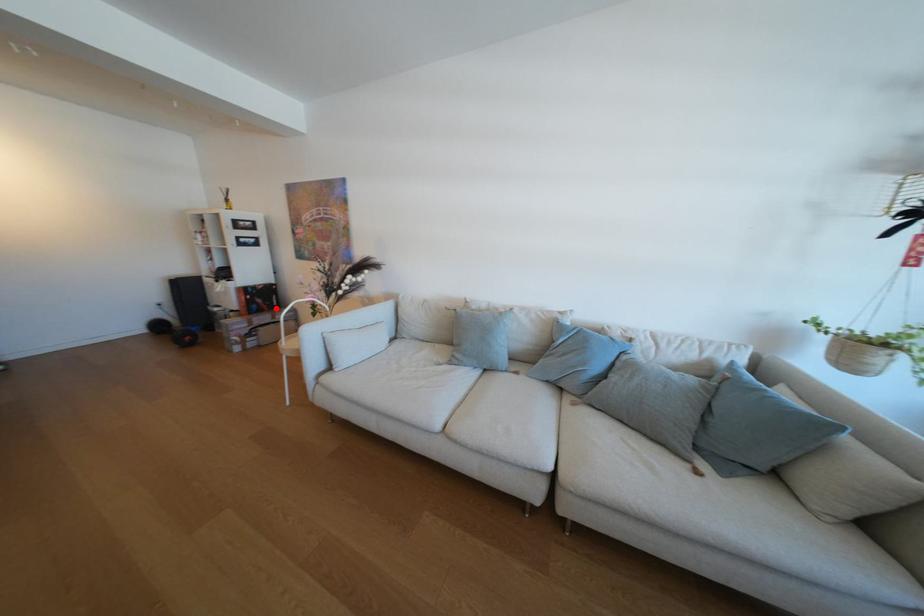
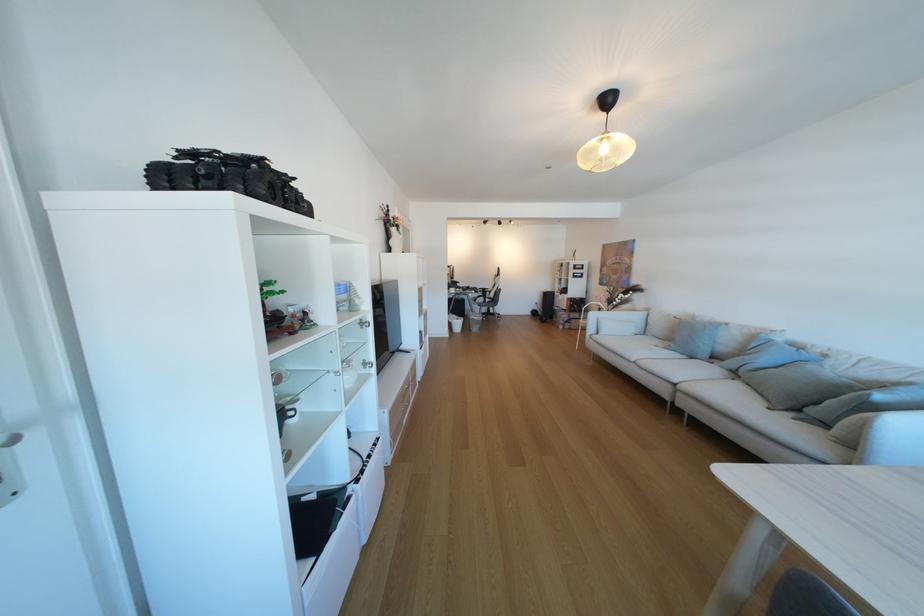
Question: I am providing you with two images of the same scene from different viewpoints. Given a red point in image1, look at the same physical point in image2. Is it:

Choices:
 (A) Closer to the viewpoint
 (B) Farther from the viewpoint

Answer: (A)